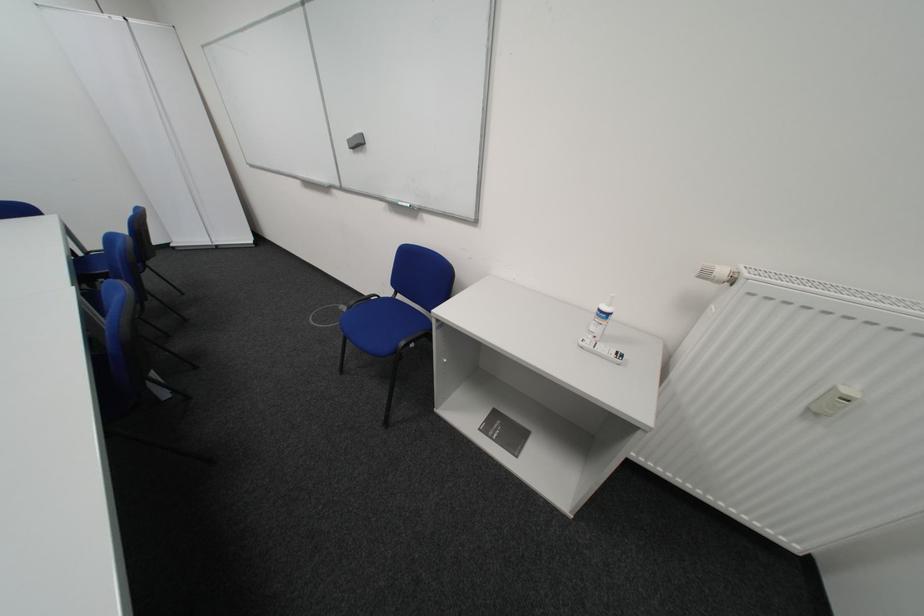
The image size is (924, 616). What do you see at coordinates (716, 274) in the screenshot?
I see `the radiator thermostat knob` at bounding box center [716, 274].